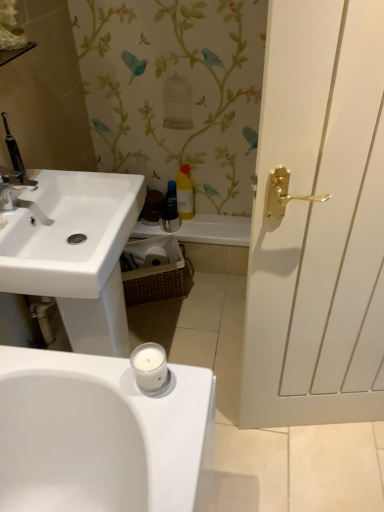
In order to face matte silver faucet at upper left, should I rotate leftwards or rightwards?

Turn left approximately 22.463 degrees to face it.

Describe the element at coordinates (19, 193) in the screenshot. I see `matte silver faucet at upper left` at that location.

At what (x,y) coordinates should I click in order to perform the action: click on yellow matte bottle at center, the first toiletry in the right-to-left sequence. Please return your answer as a coordinate pair (x, y). This screenshot has width=384, height=512. Looking at the image, I should click on (185, 193).

The height and width of the screenshot is (512, 384). Identify the location of brown woven basket at center. (155, 270).

Measure the distance between brown woven basket at center and camera.

A distance of 1.90 meters exists between brown woven basket at center and camera.

Find the location of a particular element. The height and width of the screenshot is (512, 384). translucent plastic bottle at center, which ranks as the 1th toiletry in left-to-right order is located at coordinates (171, 197).

The width and height of the screenshot is (384, 512). What do you see at coordinates (216, 230) in the screenshot?
I see `white glossy bath at center` at bounding box center [216, 230].

In order to face white wood door at right, should I rotate leftwards or rightwards?

To face it directly, rotate right by 21.050 degrees.

Locate an element on the screen. This screenshot has width=384, height=512. matte silver faucet at upper left is located at coordinates (19, 193).

From the image's perspective, which object appears higher, white wood door at right or yellow matte bottle at center, the first toiletry in the right-to-left sequence?

From the image's view, yellow matte bottle at center, the first toiletry in the right-to-left sequence, is above.

Can you tell me how much white wood door at right and yellow matte bottle at center, marked as the second toiletry in a left-to-right arrangement, differ in facing direction?

11.7 degrees separate the facing orientations of white wood door at right and yellow matte bottle at center, marked as the second toiletry in a left-to-right arrangement.

Is white wood door at right at the left side of yellow matte bottle at center, marked as the second toiletry in a left-to-right arrangement?

In fact, white wood door at right is to the right of yellow matte bottle at center, marked as the second toiletry in a left-to-right arrangement.

Is white wood door at right oriented away from yellow matte bottle at center, the first toiletry in the right-to-left sequence?

That's right, white wood door at right is facing away from yellow matte bottle at center, the first toiletry in the right-to-left sequence.

Between translucent plastic bottle at center, the 2th toiletry in the right-to-left sequence, and matte silver faucet at upper left, which one has larger size?

With larger size is matte silver faucet at upper left.

From a real-world perspective, does translucent plastic bottle at center, which ranks as the 1th toiletry in left-to-right order, stand above matte silver faucet at upper left?

No, from a real-world perspective, translucent plastic bottle at center, which ranks as the 1th toiletry in left-to-right order, is not above matte silver faucet at upper left.

Are translucent plastic bottle at center, the 2th toiletry in the right-to-left sequence, and matte silver faucet at upper left far apart?

Actually, translucent plastic bottle at center, the 2th toiletry in the right-to-left sequence, and matte silver faucet at upper left are a little close together.

Is translucent plastic bottle at center, which ranks as the 1th toiletry in left-to-right order, not within matte silver faucet at upper left?

Yes, translucent plastic bottle at center, which ranks as the 1th toiletry in left-to-right order, is located beyond the bounds of matte silver faucet at upper left.

From a real-world perspective, is yellow matte bottle at center, marked as the second toiletry in a left-to-right arrangement, beneath matte silver faucet at upper left?

Yes, from a real-world perspective, yellow matte bottle at center, marked as the second toiletry in a left-to-right arrangement, is under matte silver faucet at upper left.

Can you confirm if yellow matte bottle at center, the first toiletry in the right-to-left sequence, is bigger than matte silver faucet at upper left?

Indeed, yellow matte bottle at center, the first toiletry in the right-to-left sequence, has a larger size compared to matte silver faucet at upper left.

Is the depth of yellow matte bottle at center, marked as the second toiletry in a left-to-right arrangement, greater than that of matte silver faucet at upper left?

Yes.

Considering the points (188, 206) and (19, 185), which point is in front, point (188, 206) or point (19, 185)?

Positioned in front is point (19, 185).

From the image's perspective, is brown woven basket at center on translucent plastic bottle at center, which ranks as the 1th toiletry in left-to-right order?

Incorrect, from the image's perspective, brown woven basket at center is lower than translucent plastic bottle at center, which ranks as the 1th toiletry in left-to-right order.

You are a GUI agent. You are given a task and a screenshot of the screen. Output one action in this format:
    pyautogui.click(x=<x>, y=<y>)
    Task: Click on the toiletry that is the 1st one above the brown woven basket at center (from a real-world perspective)
    This screenshot has width=384, height=512.
    Given the screenshot: What is the action you would take?
    pyautogui.click(x=171, y=197)

Between point (164, 243) and point (167, 198), which one is positioned in front?

The point (164, 243) is more forward.

Is brown woven basket at center positioned beyond the bounds of translucent plastic bottle at center, which ranks as the 1th toiletry in left-to-right order?

brown woven basket at center lies outside translucent plastic bottle at center, which ranks as the 1th toiletry in left-to-right order,'s area.

Would you say brown woven basket at center is a long distance from yellow matte bottle at center, marked as the second toiletry in a left-to-right arrangement?

Actually, brown woven basket at center and yellow matte bottle at center, marked as the second toiletry in a left-to-right arrangement, are a little close together.

Considering the sizes of objects brown woven basket at center and yellow matte bottle at center, marked as the second toiletry in a left-to-right arrangement, in the image provided, who is shorter, brown woven basket at center or yellow matte bottle at center, marked as the second toiletry in a left-to-right arrangement,?

Standing shorter between the two is brown woven basket at center.

Can you confirm if brown woven basket at center is wider than yellow matte bottle at center, marked as the second toiletry in a left-to-right arrangement?

Yes.

How different are the orientations of brown woven basket at center and yellow matte bottle at center, marked as the second toiletry in a left-to-right arrangement, in degrees?

The angular difference between brown woven basket at center and yellow matte bottle at center, marked as the second toiletry in a left-to-right arrangement, is 23.2 degrees.

Considering the relative sizes of yellow matte bottle at center, marked as the second toiletry in a left-to-right arrangement, and white glossy bath at center in the image provided, is yellow matte bottle at center, marked as the second toiletry in a left-to-right arrangement, thinner than white glossy bath at center?

Yes, yellow matte bottle at center, marked as the second toiletry in a left-to-right arrangement, is thinner than white glossy bath at center.

Is white glossy bath at center completely or partially inside yellow matte bottle at center, marked as the second toiletry in a left-to-right arrangement?

No, white glossy bath at center is not surrounded by yellow matte bottle at center, marked as the second toiletry in a left-to-right arrangement.

From the image's perspective, which one is positioned lower, yellow matte bottle at center, the first toiletry in the right-to-left sequence, or white glossy bath at center?

white glossy bath at center is shown below in the image.

Is yellow matte bottle at center, the first toiletry in the right-to-left sequence, aimed at white glossy bath at center?

No, yellow matte bottle at center, the first toiletry in the right-to-left sequence, is not aimed at white glossy bath at center.

Which is behind, white glossy bath at center or brown woven basket at center?

white glossy bath at center is further from the camera.

From the image's perspective, is white glossy bath at center above or below brown woven basket at center?

From the image's perspective, white glossy bath at center appears above brown woven basket at center.

Consider the image. Does white glossy bath at center appear on the right side of brown woven basket at center?

Yes, white glossy bath at center is to the right of brown woven basket at center.

Is white glossy bath at center facing away from brown woven basket at center?

No, white glossy bath at center is not facing the opposite direction of brown woven basket at center.

From the image's perspective, which toiletry is the 2nd one above the white wood door at right? Please provide its 2D coordinates.

[(185, 193)]

This screenshot has height=512, width=384. Identify the location of tap that appears above the translucent plastic bottle at center, the 2th toiletry in the right-to-left sequence (from a real-world perspective). (19, 193).

Which object lies further to the anchor point translucent plastic bottle at center, the 2th toiletry in the right-to-left sequence, white wood door at right or white glossy bath at center?

white wood door at right is positioned further to the anchor translucent plastic bottle at center, the 2th toiletry in the right-to-left sequence.

When comparing their distances from white wood door at right, does yellow matte bottle at center, the first toiletry in the right-to-left sequence, or white glossy bath at center seem closer?

white glossy bath at center is closer to white wood door at right.

Considering their positions, is translucent plastic bottle at center, which ranks as the 1th toiletry in left-to-right order, positioned further to white glossy bath at center than white wood door at right?

Based on the image, white wood door at right appears to be further to white glossy bath at center.

Considering their positions, is translucent plastic bottle at center, the 2th toiletry in the right-to-left sequence, positioned further to brown woven basket at center than white glossy bath at center?

translucent plastic bottle at center, the 2th toiletry in the right-to-left sequence.

When comparing their distances from translucent plastic bottle at center, which ranks as the 1th toiletry in left-to-right order, does brown woven basket at center or white glossy bath at center seem closer?

white glossy bath at center lies closer to translucent plastic bottle at center, which ranks as the 1th toiletry in left-to-right order, than the other object.

When comparing their distances from yellow matte bottle at center, the first toiletry in the right-to-left sequence, does translucent plastic bottle at center, the 2th toiletry in the right-to-left sequence, or white wood door at right seem further?

white wood door at right.

Which object lies nearer to the anchor point matte silver faucet at upper left, brown woven basket at center or white wood door at right?

brown woven basket at center is positioned closer to the anchor matte silver faucet at upper left.

From the image, which object appears to be farther from white wood door at right, matte silver faucet at upper left or brown woven basket at center?

brown woven basket at center is positioned further to the anchor white wood door at right.

This screenshot has width=384, height=512. In order to click on basket between matte silver faucet at upper left and yellow matte bottle at center, the first toiletry in the right-to-left sequence, in the front-back direction in this screenshot , I will do `click(155, 270)`.

Where is `toiletry positioned between white wood door at right and white glossy bath at center from near to far`? toiletry positioned between white wood door at right and white glossy bath at center from near to far is located at coordinates (185, 193).

The height and width of the screenshot is (512, 384). What are the coordinates of `basket between white wood door at right and translucent plastic bottle at center, the 2th toiletry in the right-to-left sequence, along the z-axis` in the screenshot? It's located at (155, 270).

The image size is (384, 512). What are the coordinates of `basket between matte silver faucet at upper left and white glossy bath at center from front to back` in the screenshot? It's located at (155, 270).